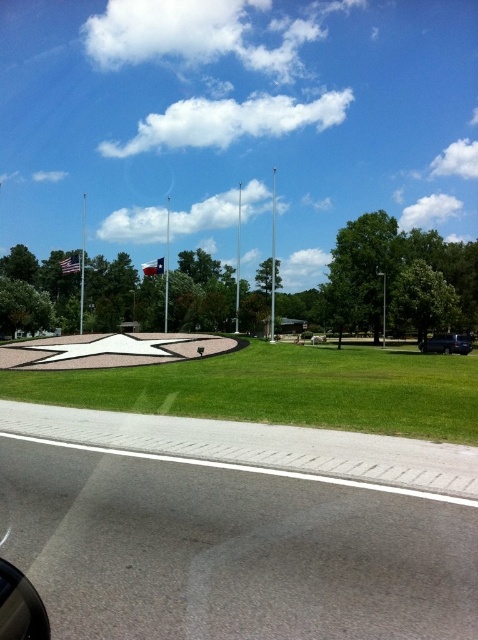
You are a gardener planning to mow the green grass at center and the black matte car at lower right. Which area requires a wider mower path?

The green grass at center requires a wider mower path because its width surpasses that of the black matte car at lower right.

You are a gardener who wants to plant flowers in the green grass at center and the transparent glass car window at lower left. Which area requires more soil because of its size?

The green grass at center requires more soil because it is larger in size than the transparent glass car window at lower left.